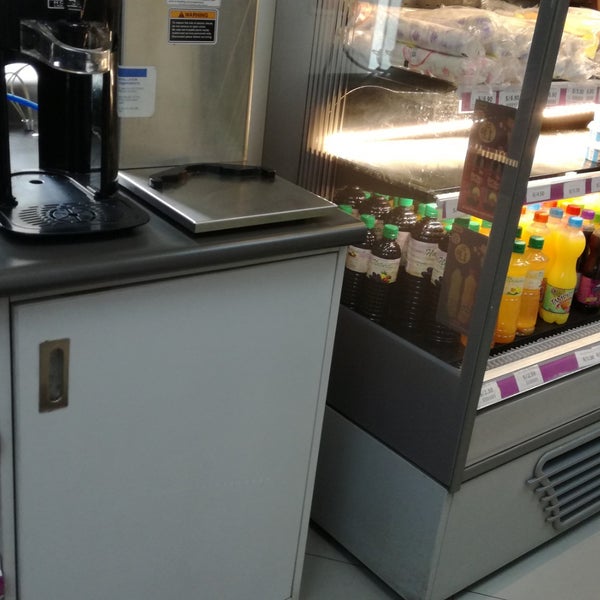
The image size is (600, 600). I want to click on grey tile floor, so click(565, 577).